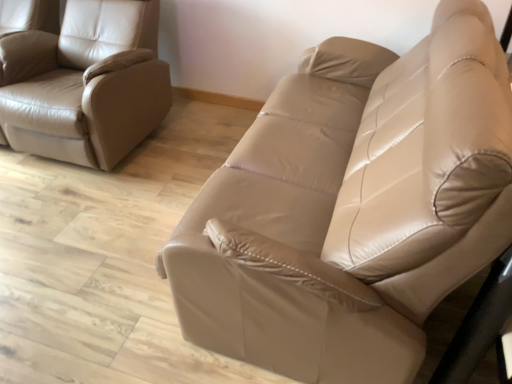
You are a GUI agent. You are given a task and a screenshot of the screen. Output one action in this format:
    pyautogui.click(x=<x>, y=<y>)
    Task: Click on the vacant area that lies between matte leather chair at left and matte leather couch at center
    This screenshot has width=512, height=384.
    Given the screenshot: What is the action you would take?
    pyautogui.click(x=141, y=195)